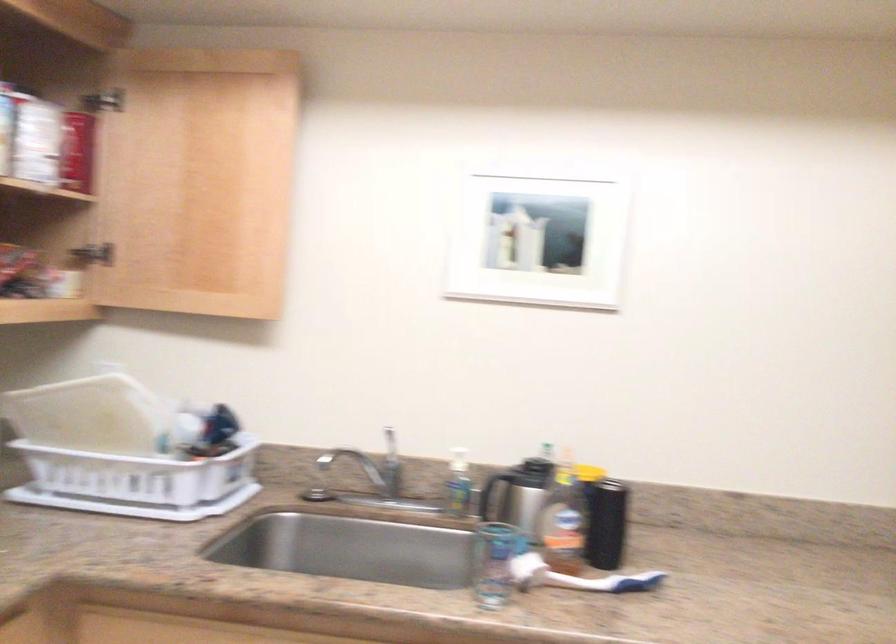
Where would you lift the faucet lever handle? Please return your answer as a coordinate pair (x, y).

(391, 447)